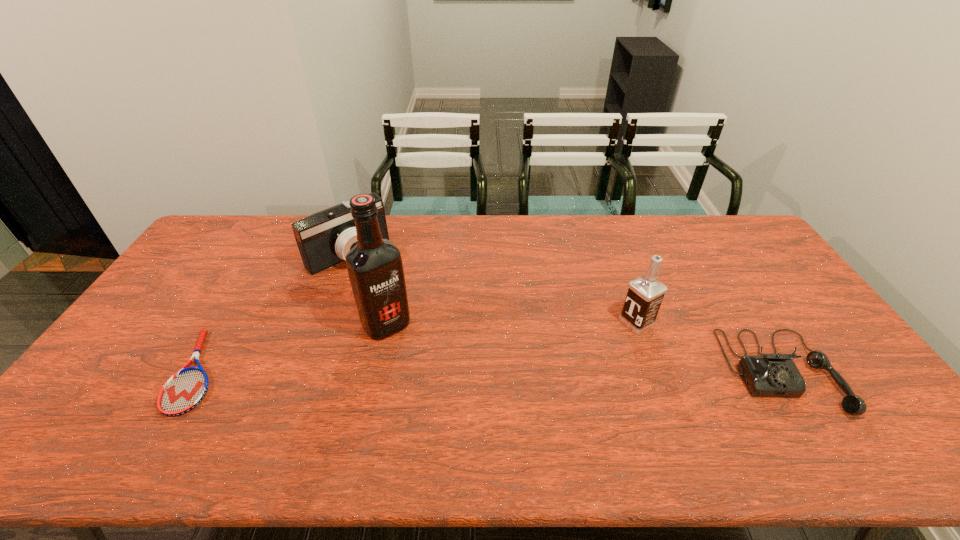
Find the location of a particular element. free space on the desktop that is between the leftmost object and the fourth tallest object and is positioned on the lens of the third tallest object is located at coordinates (471, 372).

Identify the location of free space on the desktop that is between the shortest object and the telephone and is positioned on the front-facing side of the tallest object. This screenshot has width=960, height=540. (424, 372).

Image resolution: width=960 pixels, height=540 pixels. In order to click on vacant space on the desktop that is between the shortest object and the telephone and is positioned on the front label of the second object from right to left in this screenshot , I will do `click(546, 372)`.